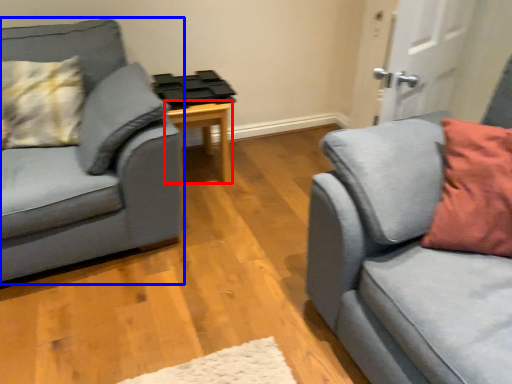
Question: Which object appears closest to the camera in this image, table (highlighted by a red box) or studio couch (highlighted by a blue box)?

Choices:
 (A) table
 (B) studio couch

Answer: (B)